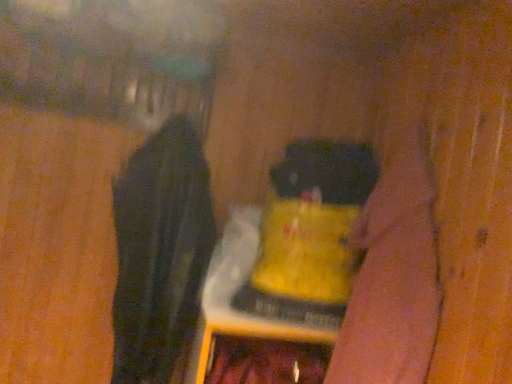
Question: Considering the relative sizes of black fabric at left and yellow matte bottle at center in the image provided, is black fabric at left wider than yellow matte bottle at center?

Choices:
 (A) no
 (B) yes

Answer: (A)

Question: Does black fabric at left lie behind yellow matte bottle at center?

Choices:
 (A) no
 (B) yes

Answer: (A)

Question: Considering the relative sizes of black fabric at left and yellow matte bottle at center in the image provided, is black fabric at left thinner than yellow matte bottle at center?

Choices:
 (A) yes
 (B) no

Answer: (A)

Question: Is black fabric at left shorter than yellow matte bottle at center?

Choices:
 (A) yes
 (B) no

Answer: (B)

Question: Is black fabric at left turned away from yellow matte bottle at center?

Choices:
 (A) yes
 (B) no

Answer: (B)

Question: Can you confirm if black fabric at left is smaller than yellow matte bottle at center?

Choices:
 (A) yes
 (B) no

Answer: (B)

Question: Is yellow matte bottle at center oriented towards velvety black cat at center?

Choices:
 (A) yes
 (B) no

Answer: (B)

Question: From a real-world perspective, is yellow matte bottle at center over velvety black cat at center?

Choices:
 (A) no
 (B) yes

Answer: (A)

Question: From the image's perspective, would you say yellow matte bottle at center is shown under velvety black cat at center?

Choices:
 (A) yes
 (B) no

Answer: (A)

Question: Is yellow matte bottle at center far away from velvety black cat at center?

Choices:
 (A) yes
 (B) no

Answer: (B)

Question: Is yellow matte bottle at center outside velvety black cat at center?

Choices:
 (A) yes
 (B) no

Answer: (A)

Question: Does yellow matte bottle at center have a greater width compared to velvety black cat at center?

Choices:
 (A) yes
 (B) no

Answer: (A)

Question: Is black fabric at left directly adjacent to velvety black cat at center?

Choices:
 (A) yes
 (B) no

Answer: (B)